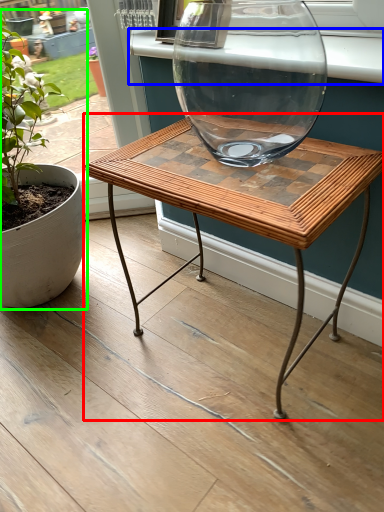
Question: Which is farther away from coffee table (highlighted by a red box)? window sill (highlighted by a blue box) or houseplant (highlighted by a green box)?

Choices:
 (A) window sill
 (B) houseplant

Answer: (B)